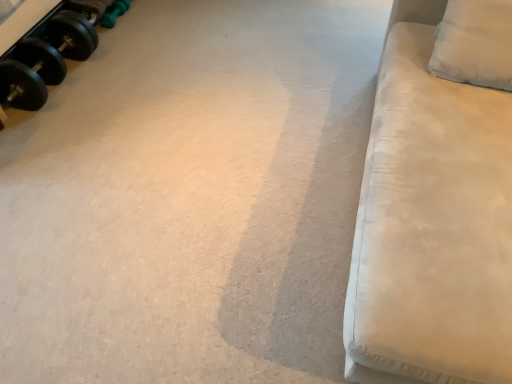
Identify the location of space that is in front of green rubber dumbbell at upper left, which appears as the first dumbbell when viewed from the back. This screenshot has width=512, height=384. (114, 38).